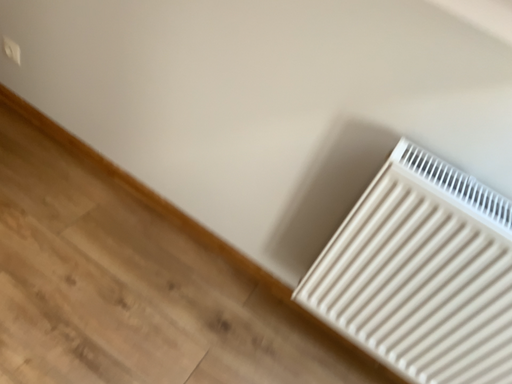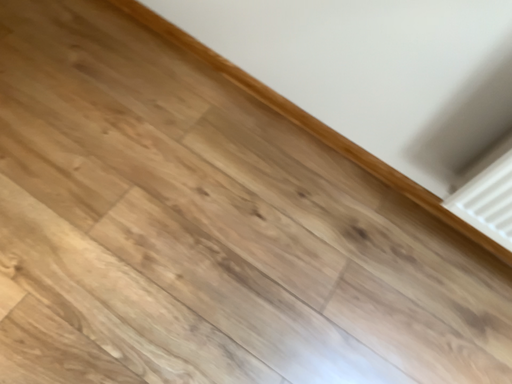
Question: Which way did the camera rotate in the video?

Choices:
 (A) rotated downward
 (B) rotated upward

Answer: (A)